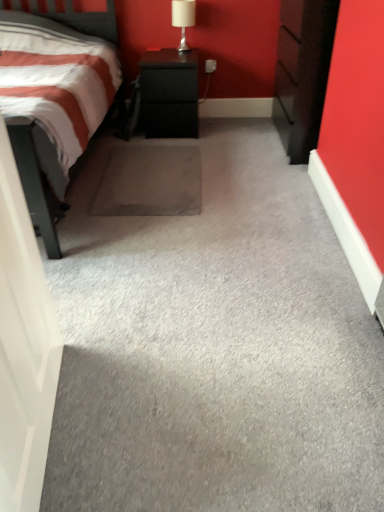
Question: Is gray carpet at center next to white glossy table lamp at upper center and touching it?

Choices:
 (A) yes
 (B) no

Answer: (B)

Question: Does gray carpet at center have a greater height compared to white glossy table lamp at upper center?

Choices:
 (A) no
 (B) yes

Answer: (A)

Question: Is gray carpet at center facing away from white glossy table lamp at upper center?

Choices:
 (A) no
 (B) yes

Answer: (A)

Question: Is gray carpet at center outside of white glossy table lamp at upper center?

Choices:
 (A) no
 (B) yes

Answer: (B)

Question: From a real-world perspective, is gray carpet at center physically above white glossy table lamp at upper center?

Choices:
 (A) yes
 (B) no

Answer: (B)

Question: Is black textured cabinet at center in front of or behind dark wood chest of drawers at right in the image?

Choices:
 (A) behind
 (B) front

Answer: (A)

Question: Do you think black textured cabinet at center is within dark wood chest of drawers at right, or outside of it?

Choices:
 (A) outside
 (B) inside

Answer: (A)

Question: Is black textured cabinet at center bigger or smaller than dark wood chest of drawers at right?

Choices:
 (A) small
 (B) big

Answer: (A)

Question: From a real-world perspective, relative to dark wood chest of drawers at right, is black textured cabinet at center vertically above or below?

Choices:
 (A) below
 (B) above

Answer: (A)

Question: From the image's perspective, is white glossy door at left above or below gray carpet at center?

Choices:
 (A) above
 (B) below

Answer: (B)

Question: Is white glossy door at left inside the boundaries of gray carpet at center, or outside?

Choices:
 (A) outside
 (B) inside

Answer: (A)

Question: Based on their positions, is white glossy door at left located to the left or right of gray carpet at center?

Choices:
 (A) left
 (B) right

Answer: (A)

Question: Does point (14, 434) appear closer or farther from the camera than point (74, 466)?

Choices:
 (A) closer
 (B) farther

Answer: (A)

Question: From their relative heights in the image, would you say dark wood chest of drawers at right is taller or shorter than white glossy table lamp at upper center?

Choices:
 (A) short
 (B) tall

Answer: (B)

Question: Does point (301, 160) appear closer or farther from the camera than point (185, 3)?

Choices:
 (A) farther
 (B) closer

Answer: (B)